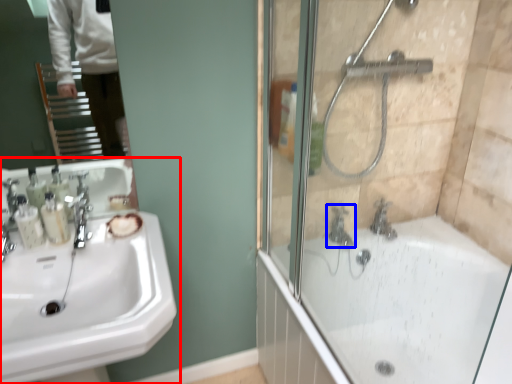
Question: Which of the following is the closest to the observer, sink (highlighted by a red box) or tap (highlighted by a blue box)?

Choices:
 (A) sink
 (B) tap

Answer: (A)